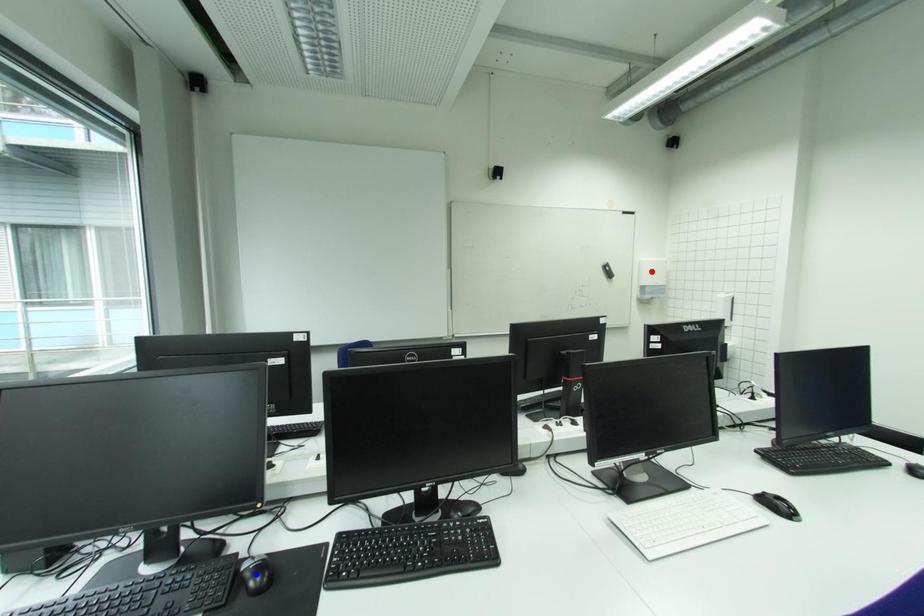
Question: Which of the two points in the image is closer to the camera?

Choices:
 (A) Blue point is closer.
 (B) Red point is closer.

Answer: (A)